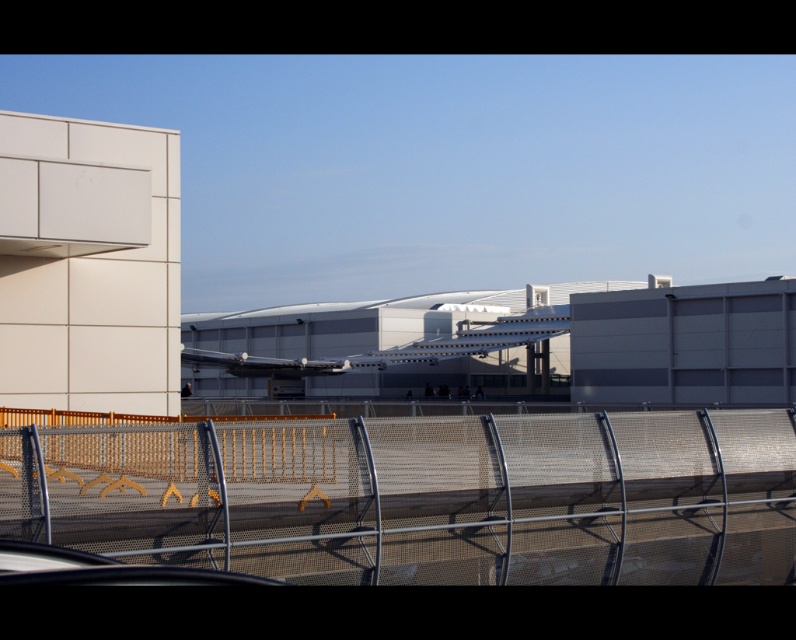
Can you confirm if metal mesh fence at center is positioned to the right of white metallic airliner at center?

Correct, you'll find metal mesh fence at center to the right of white metallic airliner at center.

Is point (635, 548) farther from viewer compared to point (531, 339)?

No, it is not.

This screenshot has width=796, height=640. Find the location of `metal mesh fence at center`. metal mesh fence at center is located at coordinates (422, 497).